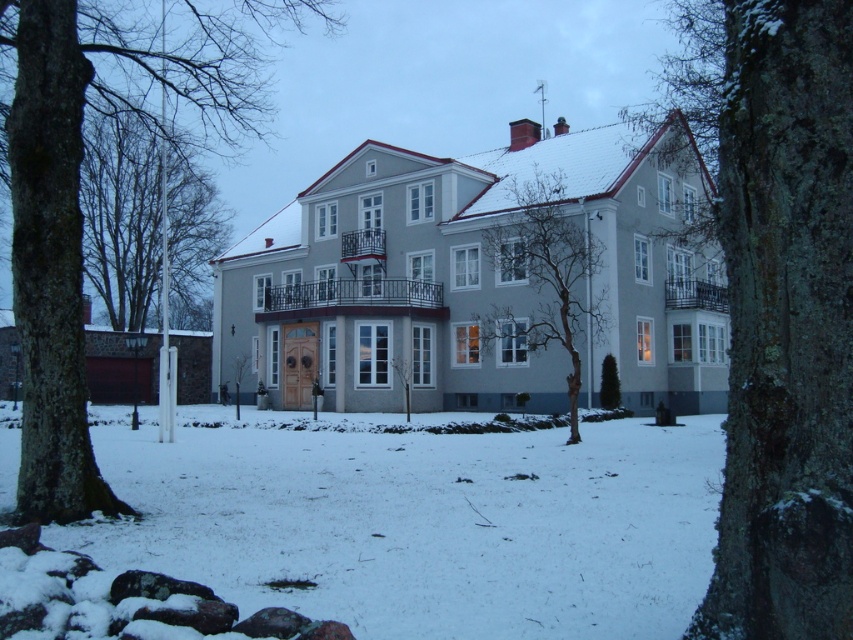
Does bare branches at left appear under bare branches at center?

Incorrect, bare branches at left is not positioned below bare branches at center.

Can you confirm if bare branches at left is thinner than bare branches at center?

In fact, bare branches at left might be wider than bare branches at center.

Between point (125, 298) and point (550, 264), which one is positioned behind?

The point (125, 298) is behind.

Where is `bare branches at left`? bare branches at left is located at coordinates (122, 216).

Is point (199, 486) positioned before point (280, 1)?

Yes.

What do you see at coordinates (421, 522) in the screenshot?
I see `white powdery snow at center` at bounding box center [421, 522].

The height and width of the screenshot is (640, 853). Identify the location of white powdery snow at center. (421, 522).

Does green mossy bark tree at center appear under bare branches at left?

Yes, green mossy bark tree at center is below bare branches at left.

Which is behind, point (793, 419) or point (91, 168)?

Positioned behind is point (91, 168).

Is point (750, 621) positioned in front of point (84, 148)?

Yes, point (750, 621) is closer to viewer.

This screenshot has width=853, height=640. What are the coordinates of `green mossy bark tree at center` in the screenshot? It's located at (781, 310).